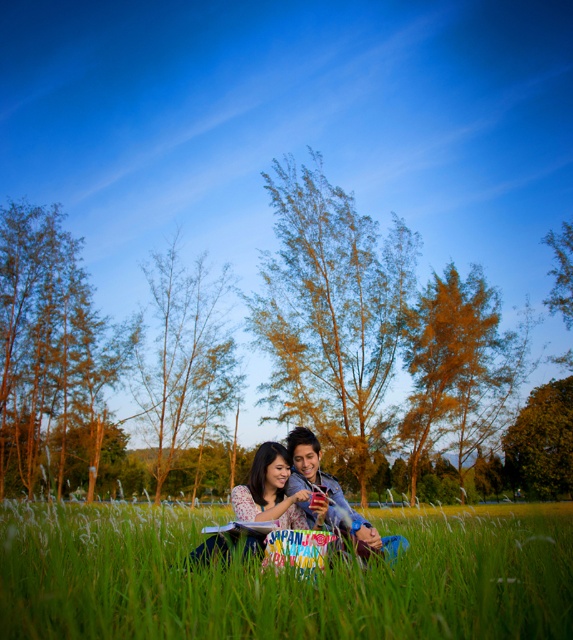
You are a photographer standing at the edge of the grassy field. You want to take a photo that includes both the green soft grass at lower center and the matte plastic phone at center. Which object will appear larger in your photo?

The green soft grass at lower center appears larger in the photo because it is closer to the viewer than the matte plastic phone at center.

You are standing in the park scene and want to walk towards the two points marked in the image. Which point, point (269, 636) or point (378, 547), will you reach first?

Point (269, 636) is closer to the viewer than point (378, 547), so you will reach point (269, 636) first.